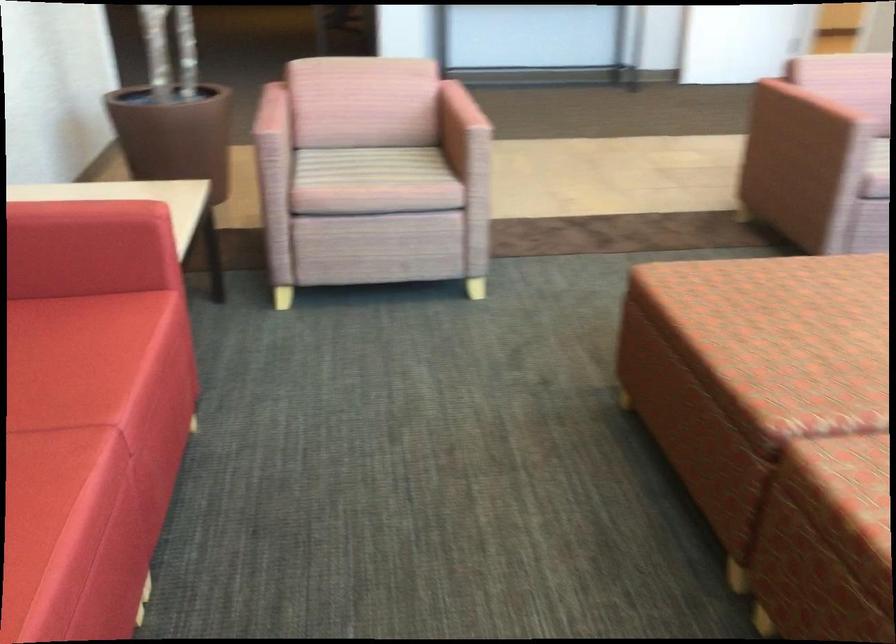
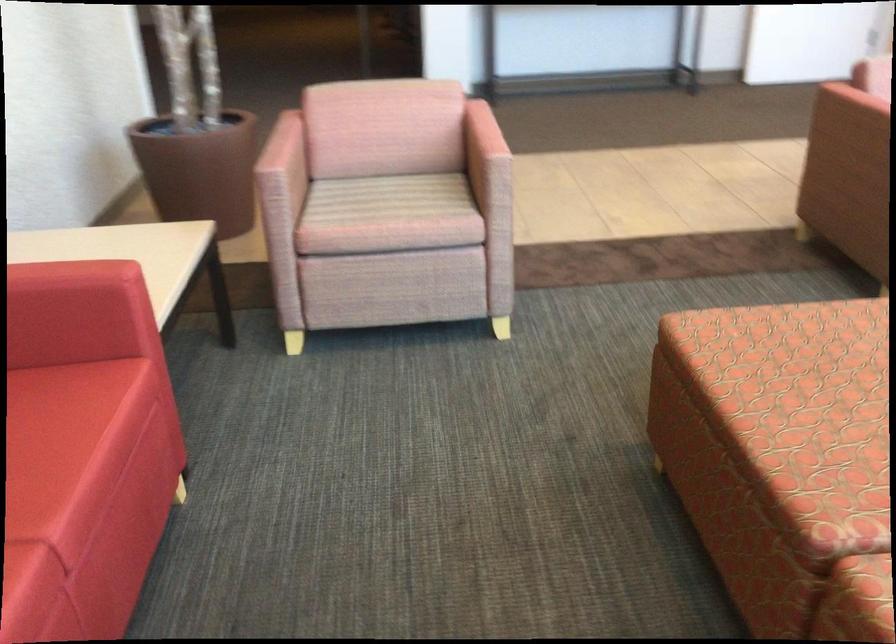
The point at (375, 164) is marked in the first image. Where is the corresponding point in the second image?

(389, 198)